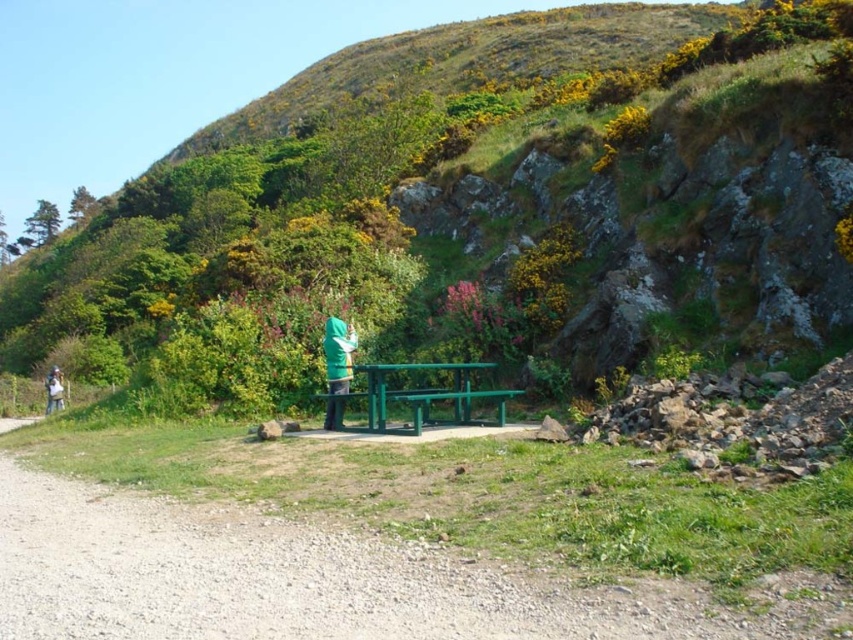
Is green metal bench at center closer to the viewer compared to green fabric jacket at center?

Yes, it is.

Who is positioned more to the right, green metal bench at center or green fabric jacket at center?

Positioned to the right is green metal bench at center.

Does point (122, 628) come farther from viewer compared to point (54, 400)?

No, (122, 628) is in front of (54, 400).

Locate an element on the screen. The width and height of the screenshot is (853, 640). green metal bench at center is located at coordinates (299, 579).

Between green grassy hillside at center and green metallic picnic table at center, which one has less height?

green metallic picnic table at center is shorter.

Between point (573, 134) and point (399, 364), which one is positioned in front?

Point (399, 364) is in front.

Locate an element on the screen. green grassy hillside at center is located at coordinates (448, 204).

Can you confirm if green grassy hillside at center is positioned to the left of green metal bench at center?

Yes, green grassy hillside at center is to the left of green metal bench at center.

Measure the distance between point [796,324] and camera.

They are 16.27 meters apart.

Where is `green grassy hillside at center`? The width and height of the screenshot is (853, 640). green grassy hillside at center is located at coordinates (448, 204).